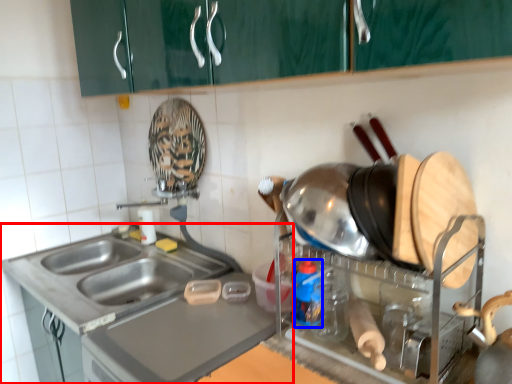
Question: Which of the following is the farthest to the observer, countertop (highlighted by a red box) or bottle (highlighted by a blue box)?

Choices:
 (A) countertop
 (B) bottle

Answer: (A)